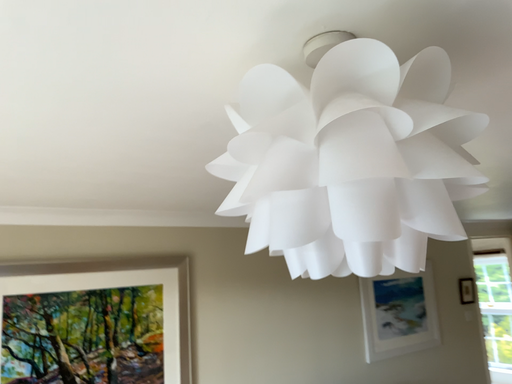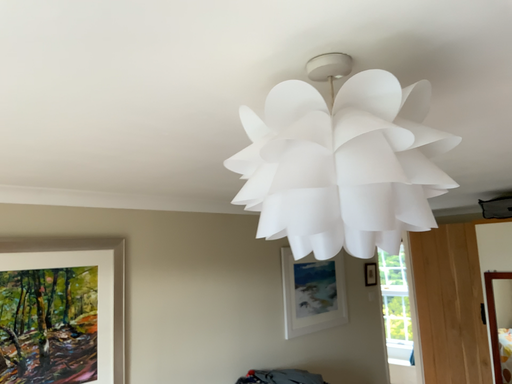
Question: How did the camera likely rotate when shooting the video?

Choices:
 (A) rotated right
 (B) rotated left

Answer: (A)